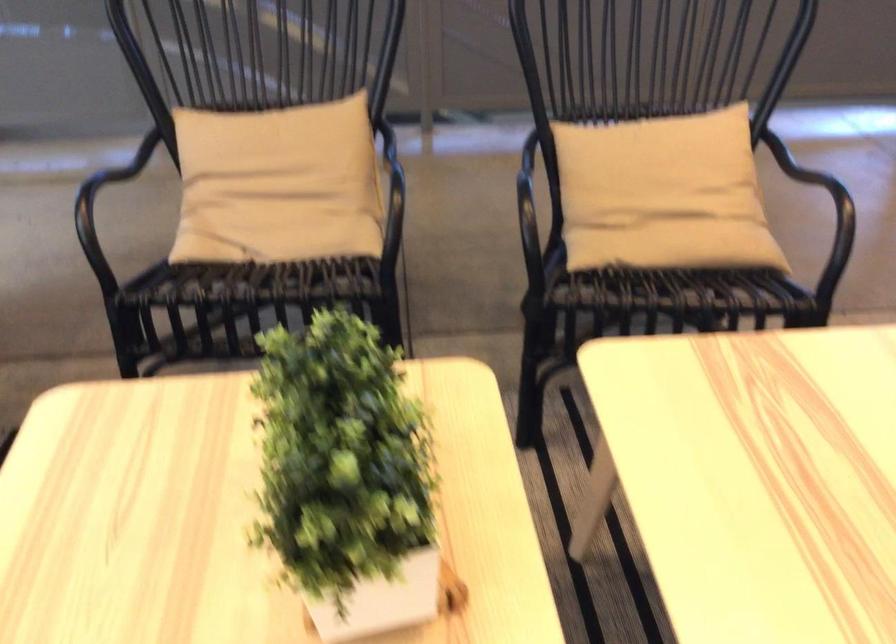
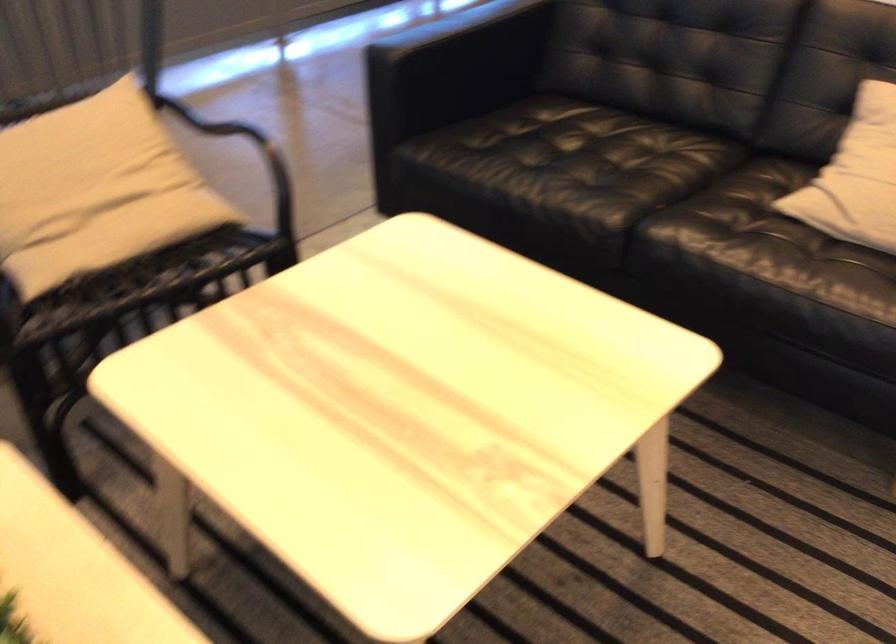
Question: The images are taken continuously from a first-person perspective. In which direction is your viewpoint rotating?

Choices:
 (A) Left
 (B) Right
 (C) Up
 (D) Down

Answer: (B)